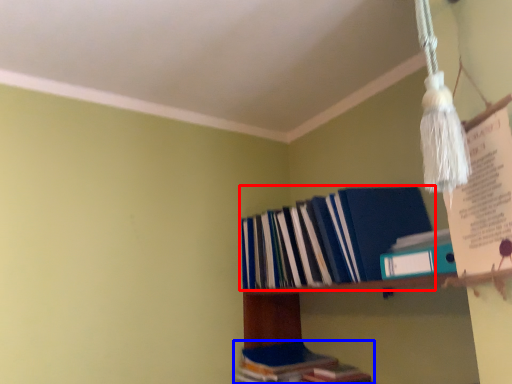
Question: Among these objects, which one is nearest to the camera, book (highlighted by a red box) or book (highlighted by a blue box)?

Choices:
 (A) book
 (B) book

Answer: (A)